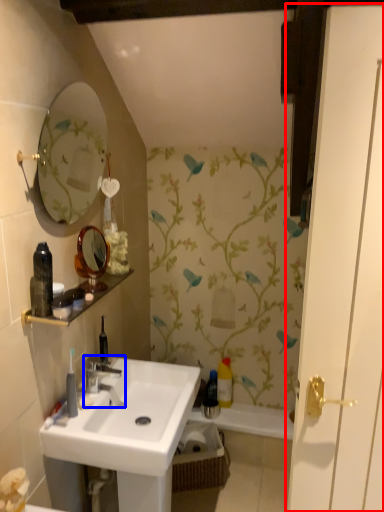
Question: Which point is further to the camera, door (highlighted by a red box) or tap (highlighted by a blue box)?

Choices:
 (A) door
 (B) tap

Answer: (B)